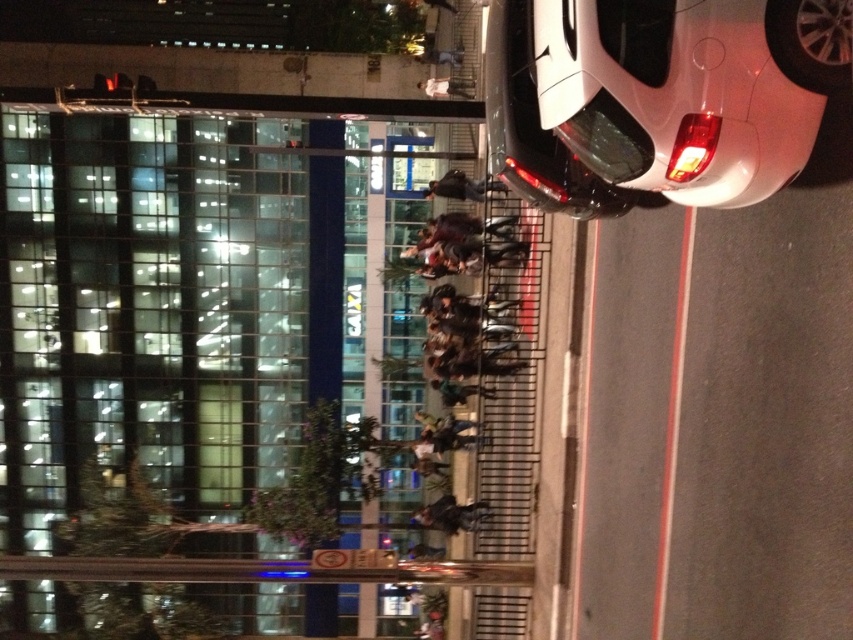
Is point (257, 333) farther from camera compared to point (576, 52)?

Yes.

This screenshot has height=640, width=853. Identify the location of transparent glass building at upper left. (170, 301).